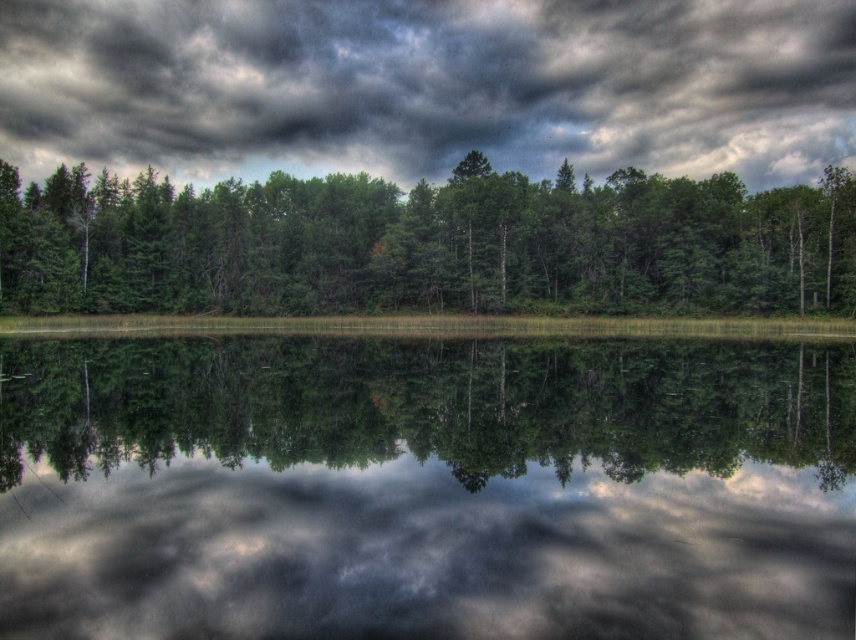
Is smooth reflective water at center taller than green matte forest at center?

In fact, smooth reflective water at center may be shorter than green matte forest at center.

Who is higher up, smooth reflective water at center or green matte forest at center?

green matte forest at center is higher up.

Which is behind, point (348, 634) or point (464, 177)?

Positioned behind is point (464, 177).

This screenshot has height=640, width=856. Identify the location of smooth reflective water at center. (425, 488).

Which is below, dark gray textured clouds at upper center or green matte forest at center?

Positioned lower is green matte forest at center.

Consider the image. Is the position of dark gray textured clouds at upper center more distant than that of green matte forest at center?

Yes, dark gray textured clouds at upper center is further from the viewer.

Measure the distance between dark gray textured clouds at upper center and camera.

The distance of dark gray textured clouds at upper center from camera is 233.02 meters.

Locate an element on the screen. This screenshot has width=856, height=640. dark gray textured clouds at upper center is located at coordinates (428, 86).

Who is positioned more to the right, smooth reflective water at center or dark gray textured clouds at upper center?

smooth reflective water at center is more to the right.

Does point (817, 465) come closer to viewer compared to point (90, 42)?

Yes, it is.

Is point (450, 627) behind point (535, 92)?

No, (450, 627) is closer to viewer.

The image size is (856, 640). I want to click on smooth reflective water at center, so click(425, 488).